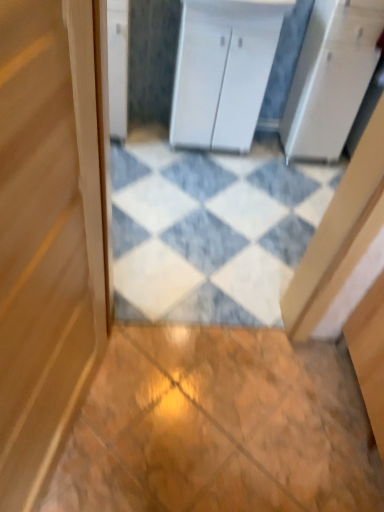
This screenshot has height=512, width=384. Find the location of `vacant area on top of wooden tile at center, the second tile from the top (from a real-world perspective)`. vacant area on top of wooden tile at center, the second tile from the top (from a real-world perspective) is located at coordinates [213, 404].